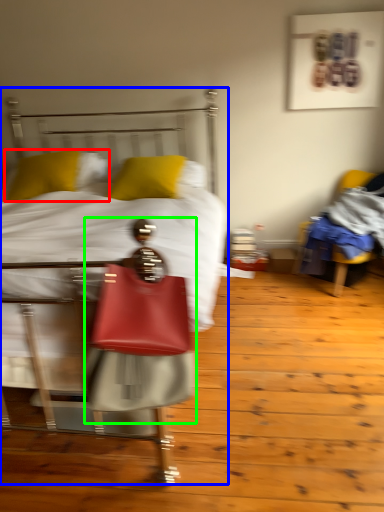
Question: Which object is the closest to the pillow (highlighted by a red box)? Choose among these: bed (highlighted by a blue box) or person (highlighted by a green box).

Choices:
 (A) bed
 (B) person

Answer: (A)